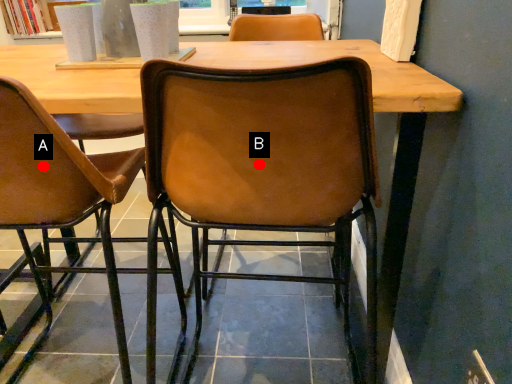
Question: Two points are circled on the image, labeled by A and B beside each circle. Among these points, which one is farthest from the camera?

Choices:
 (A) A is further
 (B) B is further

Answer: (A)